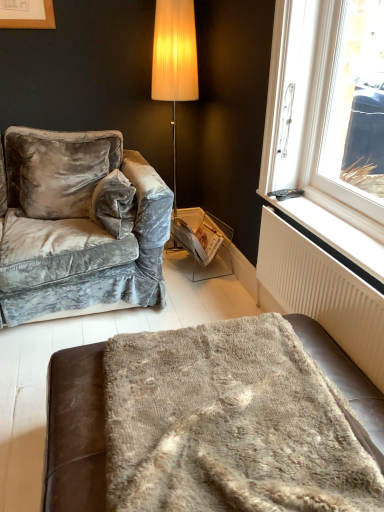
Locate an element on the screen. This screenshot has height=512, width=384. fuzzy beige blanket at lower center is located at coordinates (230, 424).

Describe the element at coordinates (322, 293) in the screenshot. I see `white textured radiator at lower right` at that location.

Where is `white plastic radiator at lower right`? This screenshot has width=384, height=512. white plastic radiator at lower right is located at coordinates (334, 237).

In terms of height, does white textured radiator at lower right look taller or shorter compared to white plastic window at upper right?

In the image, white textured radiator at lower right appears to be shorter than white plastic window at upper right.

From a real-world perspective, is white textured radiator at lower right beneath white plastic window at upper right?

Correct, in the physical world, white textured radiator at lower right is lower than white plastic window at upper right.

Is white textured radiator at lower right to the left of white plastic window at upper right from the viewer's perspective?

Correct, you'll find white textured radiator at lower right to the left of white plastic window at upper right.

From the image's perspective, between white textured radiator at lower right and white plastic window at upper right, which one is located above?

From the image's view, white plastic window at upper right is above.

Between white glossy magazine at center and white plastic radiator at lower right, which one has smaller size?

With smaller size is white plastic radiator at lower right.

Is white glossy magazine at center in contact with white plastic radiator at lower right?

white glossy magazine at center is not next to white plastic radiator at lower right, and they're not touching.

Visually, is white glossy magazine at center positioned to the left or to the right of white plastic radiator at lower right?

From the image, it's evident that white glossy magazine at center is to the left of white plastic radiator at lower right.

Could you tell me if white glossy magazine at center is facing white plastic radiator at lower right?

Yes, white glossy magazine at center is turned towards white plastic radiator at lower right.

Which is more to the left, white glossy magazine at center or white textured radiator at lower right?

white glossy magazine at center.

From a real-world perspective, between white glossy magazine at center and white textured radiator at lower right, who is vertically lower?

white glossy magazine at center.

Can we say white glossy magazine at center lies outside white textured radiator at lower right?

Yes.

Between velvet gray couch at left and white plastic radiator at lower right, which one has smaller size?

With smaller size is white plastic radiator at lower right.

Is velvet gray couch at left closer to camera compared to white plastic radiator at lower right?

That is False.

Is point (71, 262) less distant than point (302, 226)?

No, it is behind (302, 226).

Does velvet gray couch at left have a greater height compared to white plastic radiator at lower right?

Yes.

Is fuzzy beige blanket at lower center oriented towards white plastic window at upper right?

No, fuzzy beige blanket at lower center does not turn towards white plastic window at upper right.

From the image's perspective, between fuzzy beige blanket at lower center and white plastic window at upper right, which one is located above?

From the image's view, white plastic window at upper right is above.

Choose the correct answer: Is fuzzy beige blanket at lower center inside white plastic window at upper right or outside it?

fuzzy beige blanket at lower center exists outside the volume of white plastic window at upper right.

Do you think white plastic window at upper right is within white glossy magazine at center, or outside of it?

white plastic window at upper right is not inside white glossy magazine at center, it's outside.

Consider the image. Between white plastic window at upper right and white glossy magazine at center, which one has smaller size?

With smaller size is white glossy magazine at center.

How much distance is there between white plastic window at upper right and white glossy magazine at center?

white plastic window at upper right is 34.79 inches away from white glossy magazine at center.

Is the depth of white plastic window at upper right greater than that of white glossy magazine at center?

No, it is in front of white glossy magazine at center.

The height and width of the screenshot is (512, 384). Find the location of `magazine below the velvet gray couch at left (from the image's perspective)`. magazine below the velvet gray couch at left (from the image's perspective) is located at coordinates (198, 239).

Is white glossy magazine at center positioned in front of velvet gray couch at left?

No.

In the scene shown: How far apart are white glossy magazine at center and velvet gray couch at left?

white glossy magazine at center and velvet gray couch at left are 26.18 inches apart from each other.

The height and width of the screenshot is (512, 384). Find the location of `radiator to the left of white plastic window at upper right`. radiator to the left of white plastic window at upper right is located at coordinates (322, 293).

You are a GUI agent. You are given a task and a screenshot of the screen. Output one action in this format:
    pyautogui.click(x=<x>, y=<y>)
    Task: Click on the magazine below the white plastic radiator at lower right (from the image's perspective)
    The image size is (384, 512).
    Given the screenshot: What is the action you would take?
    pyautogui.click(x=198, y=239)

From the image, which object appears to be farther from white plastic window at upper right, fuzzy beige blanket at lower center or velvet gray couch at left?

velvet gray couch at left is further to white plastic window at upper right.

Estimate the real-world distances between objects in this image. Which object is further from white plastic window at upper right, velvet gray couch at left or white plastic radiator at lower right?

velvet gray couch at left lies further to white plastic window at upper right than the other object.

Consider the image. Looking at the image, which one is located further to fuzzy beige blanket at lower center, white plastic radiator at lower right or velvet gray couch at left?

Among the two, velvet gray couch at left is located further to fuzzy beige blanket at lower center.

Looking at the image, which one is located closer to white glossy magazine at center, velvet gray couch at left or white textured radiator at lower right?

velvet gray couch at left.

Estimate the real-world distances between objects in this image. Which object is further from fuzzy beige blanket at lower center, white glossy magazine at center or white plastic radiator at lower right?

white glossy magazine at center is further to fuzzy beige blanket at lower center.

Considering their positions, is white glossy magazine at center positioned closer to white plastic radiator at lower right than white textured radiator at lower right?

Based on the image, white textured radiator at lower right appears to be nearer to white plastic radiator at lower right.

Looking at the image, which one is located further to white glossy magazine at center, white plastic window at upper right or fuzzy beige blanket at lower center?

The object further to white glossy magazine at center is fuzzy beige blanket at lower center.

When comparing their distances from white plastic window at upper right, does white textured radiator at lower right or fuzzy beige blanket at lower center seem further?

The object further to white plastic window at upper right is fuzzy beige blanket at lower center.

The image size is (384, 512). In order to click on blanket between velvet gray couch at left and white textured radiator at lower right from left to right in this screenshot , I will do `click(230, 424)`.

Find the location of a particular element. This screenshot has height=512, width=384. window sill located between white plastic window at upper right and white glossy magazine at center in the depth direction is located at coordinates (334, 237).

This screenshot has height=512, width=384. Find the location of `window between fuzzy beige blanket at lower center and white glossy magazine at center in the front-back direction`. window between fuzzy beige blanket at lower center and white glossy magazine at center in the front-back direction is located at coordinates (329, 123).

Find the location of `window sill between white textured radiator at lower right and white glossy magazine at center along the z-axis`. window sill between white textured radiator at lower right and white glossy magazine at center along the z-axis is located at coordinates (334, 237).